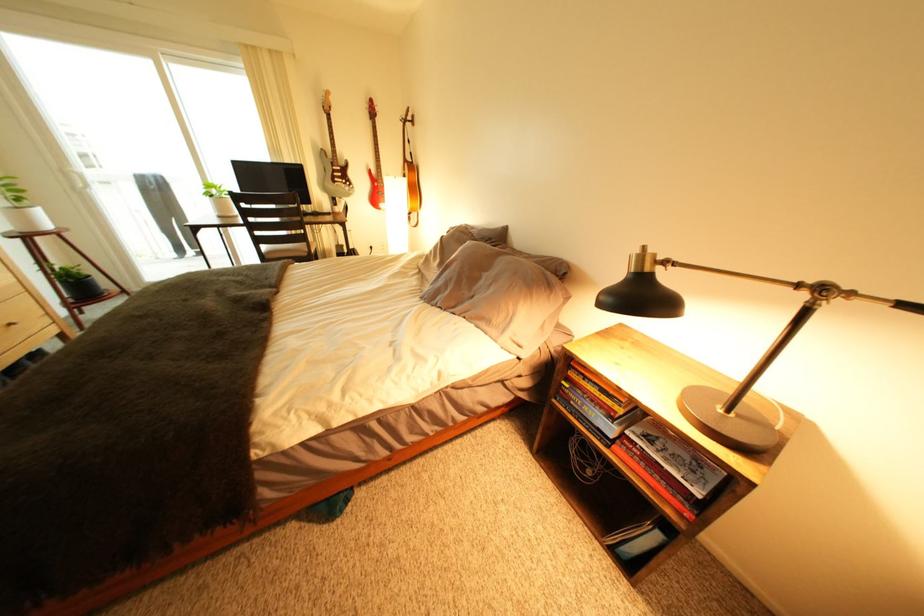
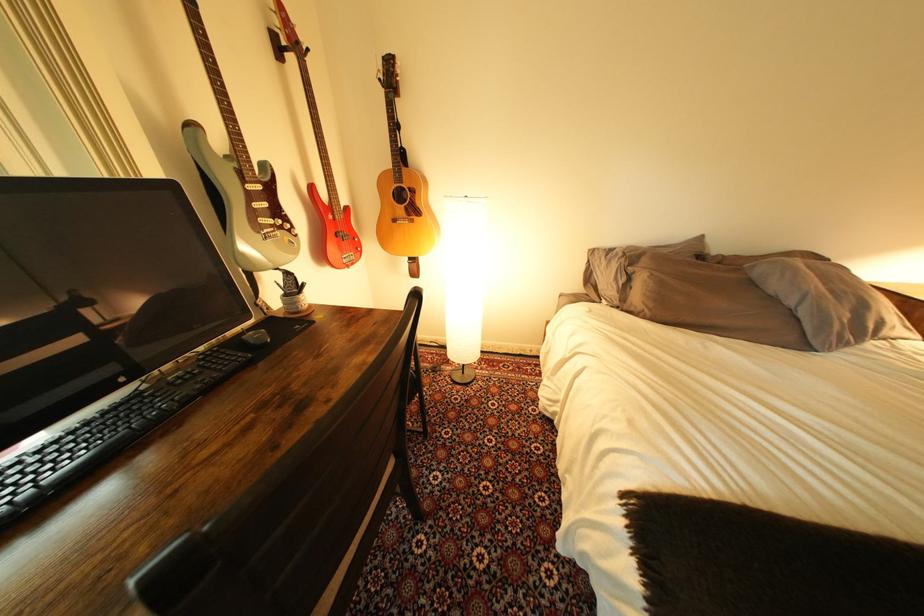
In the second image, find the point that corresponds to point (434, 270) in the first image.

(701, 322)